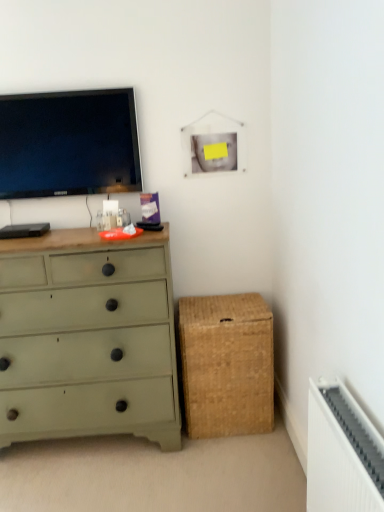
Question: Is braided wicker storage box at lower right not close to green painted wood chest of drawers at left?

Choices:
 (A) yes
 (B) no

Answer: (B)

Question: Is braided wicker storage box at lower right in front of green painted wood chest of drawers at left?

Choices:
 (A) yes
 (B) no

Answer: (B)

Question: Considering the relative positions of braided wicker storage box at lower right and green painted wood chest of drawers at left in the image provided, is braided wicker storage box at lower right behind green painted wood chest of drawers at left?

Choices:
 (A) no
 (B) yes

Answer: (B)

Question: Can you confirm if braided wicker storage box at lower right is wider than green painted wood chest of drawers at left?

Choices:
 (A) yes
 (B) no

Answer: (B)

Question: From a real-world perspective, does braided wicker storage box at lower right stand above green painted wood chest of drawers at left?

Choices:
 (A) yes
 (B) no

Answer: (B)

Question: Is braided wicker storage box at lower right next to green painted wood chest of drawers at left and touching it?

Choices:
 (A) yes
 (B) no

Answer: (B)

Question: Considering the relative positions of green painted wood chest of drawers at left and matte black tv at upper left in the image provided, is green painted wood chest of drawers at left in front of matte black tv at upper left?

Choices:
 (A) no
 (B) yes

Answer: (B)

Question: Does green painted wood chest of drawers at left have a greater width compared to matte black tv at upper left?

Choices:
 (A) yes
 (B) no

Answer: (A)

Question: Does green painted wood chest of drawers at left come behind matte black tv at upper left?

Choices:
 (A) no
 (B) yes

Answer: (A)

Question: Can you confirm if green painted wood chest of drawers at left is bigger than matte black tv at upper left?

Choices:
 (A) yes
 (B) no

Answer: (A)

Question: Does green painted wood chest of drawers at left turn towards matte black tv at upper left?

Choices:
 (A) no
 (B) yes

Answer: (A)

Question: Is matte black tv at upper left a part of green painted wood chest of drawers at left?

Choices:
 (A) no
 (B) yes

Answer: (A)

Question: Is braided wicker storage box at lower right at the back of green painted wood chest of drawers at left?

Choices:
 (A) yes
 (B) no

Answer: (B)